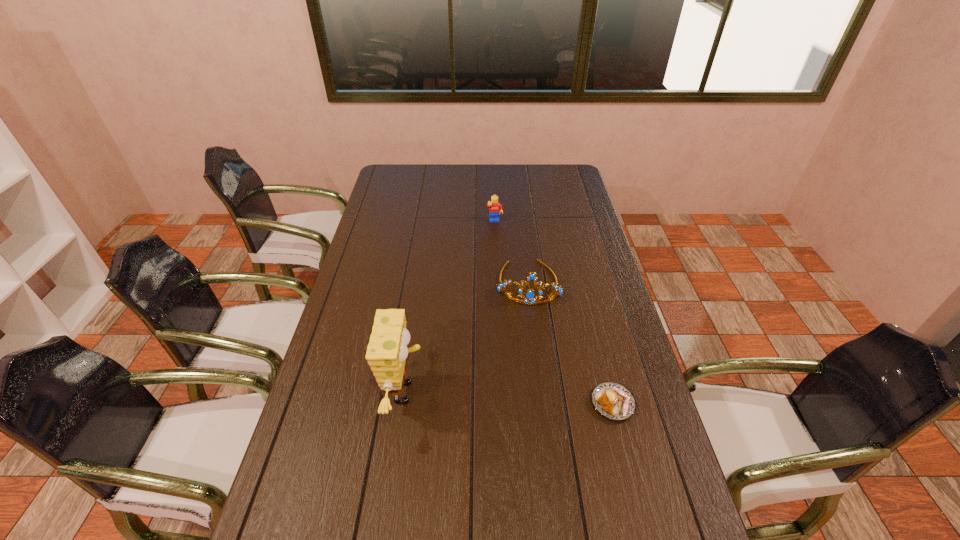
Image resolution: width=960 pixels, height=540 pixels. In order to click on free space between the tiara and the shortest object in this screenshot , I will do `click(570, 343)`.

Identify which object is the third nearest to the pastry. Please provide its 2D coordinates. Your answer should be formatted as a tuple, i.e. [(x, y)], where the tuple contains the x and y coordinates of a point satisfying the conditions above.

[(494, 206)]

Where is `the third closest object to the leftmost object`? This screenshot has width=960, height=540. the third closest object to the leftmost object is located at coordinates (494, 206).

Find the location of a particular element. free space that satisfies the following two spatial constraints: 1. on the front side of the third nearest object; 2. on the left side of the shortest object is located at coordinates (543, 403).

The height and width of the screenshot is (540, 960). Find the location of `vacant space that satisfies the following two spatial constraints: 1. on the front side of the second shortest object; 2. on the right side of the pastry`. vacant space that satisfies the following two spatial constraints: 1. on the front side of the second shortest object; 2. on the right side of the pastry is located at coordinates (503, 403).